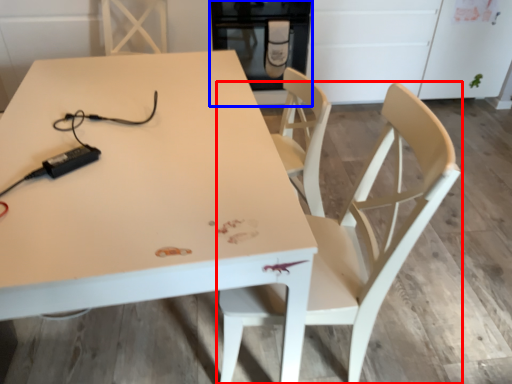
Question: Among these objects, which one is nearest to the camera, chair (highlighted by a red box) or appliance (highlighted by a blue box)?

Choices:
 (A) chair
 (B) appliance

Answer: (A)